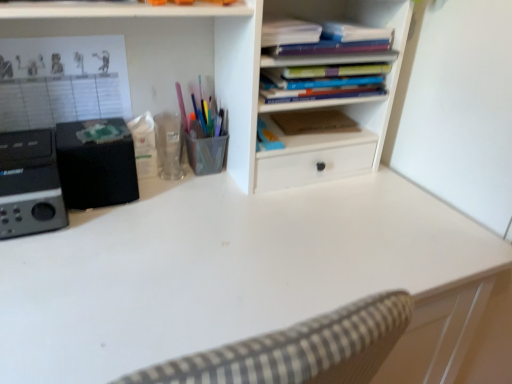
Question: Is black plastic speaker at left with matte blue notebook at upper center, marked as the second book in a bottom-to-top arrangement?

Choices:
 (A) no
 (B) yes

Answer: (A)

Question: Is black plastic speaker at left positioned in front of matte blue notebook at upper center, which ranks as the first book in top-to-bottom order?

Choices:
 (A) yes
 (B) no

Answer: (A)

Question: Does black plastic speaker at left have a larger size compared to matte blue notebook at upper center, which ranks as the first book in top-to-bottom order?

Choices:
 (A) no
 (B) yes

Answer: (B)

Question: Is black plastic speaker at left taller than matte blue notebook at upper center, marked as the second book in a bottom-to-top arrangement?

Choices:
 (A) no
 (B) yes

Answer: (B)

Question: Considering the relative positions of black plastic speaker at left and matte blue notebook at upper center, marked as the second book in a bottom-to-top arrangement, in the image provided, is black plastic speaker at left to the left of matte blue notebook at upper center, marked as the second book in a bottom-to-top arrangement, from the viewer's perspective?

Choices:
 (A) yes
 (B) no

Answer: (A)

Question: Is the depth of black plastic speaker at left greater than that of matte blue notebook at upper center, marked as the second book in a bottom-to-top arrangement?

Choices:
 (A) yes
 (B) no

Answer: (B)

Question: Considering the relative positions of hardcover books at upper center, marked as the 1th book in a bottom-to-top arrangement, and white matte desk at center in the image provided, is hardcover books at upper center, marked as the 1th book in a bottom-to-top arrangement, behind white matte desk at center?

Choices:
 (A) no
 (B) yes

Answer: (B)

Question: From the image's perspective, would you say hardcover books at upper center, which is the second book from top to bottom, is positioned over white matte desk at center?

Choices:
 (A) no
 (B) yes

Answer: (B)

Question: Is hardcover books at upper center, marked as the 1th book in a bottom-to-top arrangement, aimed at white matte desk at center?

Choices:
 (A) no
 (B) yes

Answer: (A)

Question: Is hardcover books at upper center, which is the second book from top to bottom, bigger than white matte desk at center?

Choices:
 (A) yes
 (B) no

Answer: (B)

Question: Is hardcover books at upper center, which is the second book from top to bottom, to the left of white matte desk at center from the viewer's perspective?

Choices:
 (A) no
 (B) yes

Answer: (A)

Question: Is hardcover books at upper center, which is the second book from top to bottom, placed right next to white matte desk at center?

Choices:
 (A) yes
 (B) no

Answer: (B)

Question: Is hardcover books at upper center, which is the second book from top to bottom, closer to camera compared to translucent plastic pen holder at center?

Choices:
 (A) yes
 (B) no

Answer: (A)